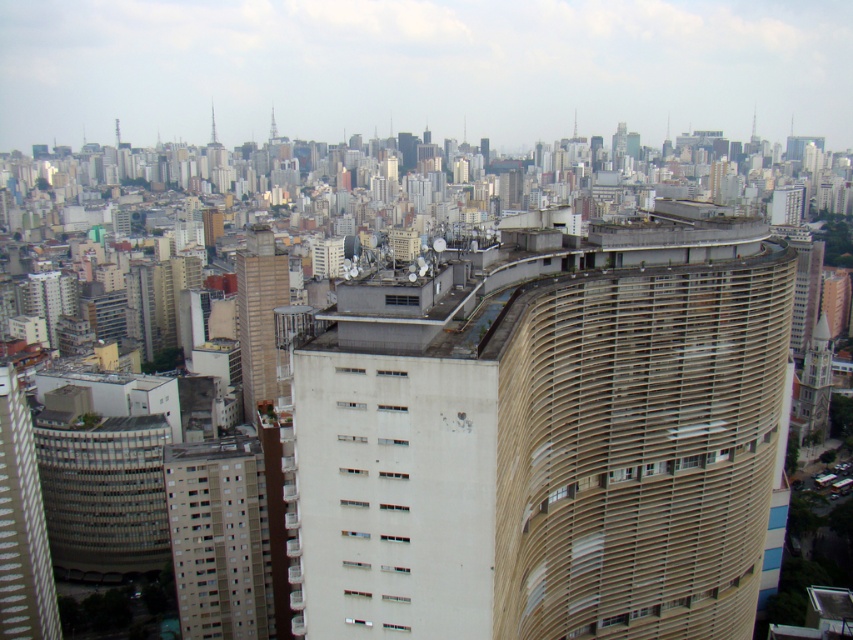
You are a drone operator tasked with capturing aerial footage of the beige textured building at center and the white textured building at left. Since you want to ensure both buildings are fully visible in the frame, which building requires you to fly higher to capture its full height?

The beige textured building at center requires you to fly higher because it is much taller than the white textured building at left, so capturing its full height would necessitate a higher altitude to ensure it fits within the camera frame.

You are standing at a viewpoint overlooking the city and want to know how far the point at coordinates point [543,609] is from your current position. Can you determine the distance?

The distance between point [543,609] and the viewer is 114.99 meters.

You are standing at the edge of an urban area and want to estimate how far the beige textured building at center is from you. Based on the aerial view provided, can you determine its distance?

The beige textured building at center is 86.24 meters away from the viewer.